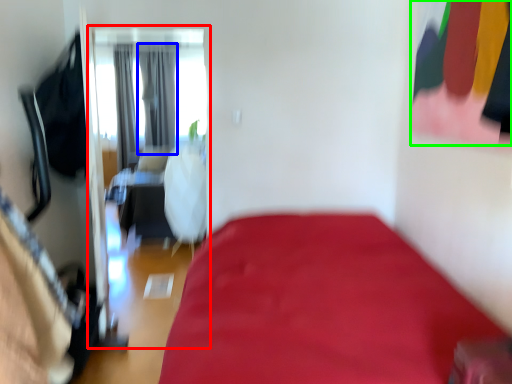
Question: Which object is positioned closest to screen door (highlighted by a red box)? Select from curtain (highlighted by a blue box) and clothing (highlighted by a green box).

Choices:
 (A) curtain
 (B) clothing

Answer: (A)